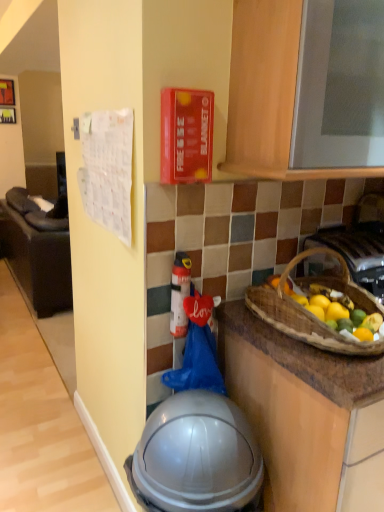
Question: From the image's perspective, is wooden cabinet at upper center beneath transparent plastic helmet at lower center?

Choices:
 (A) no
 (B) yes

Answer: (A)

Question: Is wooden cabinet at upper center located outside transparent plastic helmet at lower center?

Choices:
 (A) yes
 (B) no

Answer: (A)

Question: Is wooden cabinet at upper center looking in the opposite direction of transparent plastic helmet at lower center?

Choices:
 (A) no
 (B) yes

Answer: (A)

Question: Considering the relative sizes of wooden cabinet at upper center and transparent plastic helmet at lower center in the image provided, is wooden cabinet at upper center thinner than transparent plastic helmet at lower center?

Choices:
 (A) yes
 (B) no

Answer: (A)

Question: Is wooden cabinet at upper center shorter than transparent plastic helmet at lower center?

Choices:
 (A) no
 (B) yes

Answer: (B)

Question: From a real-world perspective, is transparent plastic helmet at lower center physically located above or below brown woven basket at right?

Choices:
 (A) above
 (B) below

Answer: (B)

Question: From the image's perspective, is transparent plastic helmet at lower center positioned above or below brown woven basket at right?

Choices:
 (A) above
 (B) below

Answer: (B)

Question: Choose the correct answer: Is transparent plastic helmet at lower center inside brown woven basket at right or outside it?

Choices:
 (A) outside
 (B) inside

Answer: (A)

Question: Is transparent plastic helmet at lower center wider or thinner than brown woven basket at right?

Choices:
 (A) wide
 (B) thin

Answer: (B)

Question: Is wooden cabinet at upper center wider or thinner than transparent plastic helmet at lower center?

Choices:
 (A) thin
 (B) wide

Answer: (A)

Question: From a real-world perspective, is wooden cabinet at upper center above or below transparent plastic helmet at lower center?

Choices:
 (A) below
 (B) above

Answer: (B)

Question: In the image, is wooden cabinet at upper center positioned in front of or behind transparent plastic helmet at lower center?

Choices:
 (A) front
 (B) behind

Answer: (A)

Question: From the image's perspective, relative to transparent plastic helmet at lower center, is wooden cabinet at upper center above or below?

Choices:
 (A) above
 (B) below

Answer: (A)

Question: Is white fabric calendar at left inside or outside of metallic silver gas stove at right?

Choices:
 (A) inside
 (B) outside

Answer: (B)

Question: From the image's perspective, is white fabric calendar at left positioned above or below metallic silver gas stove at right?

Choices:
 (A) above
 (B) below

Answer: (A)